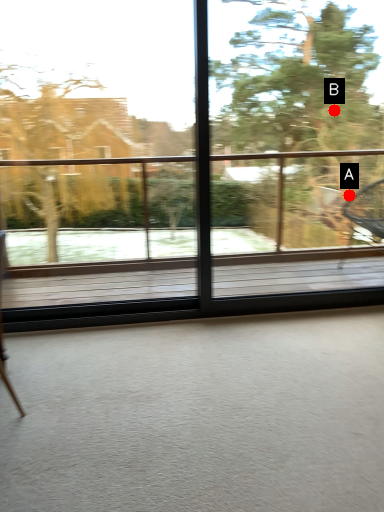
Question: Two points are circled on the image, labeled by A and B beside each circle. Which point is further to the camera?

Choices:
 (A) A is further
 (B) B is further

Answer: (A)